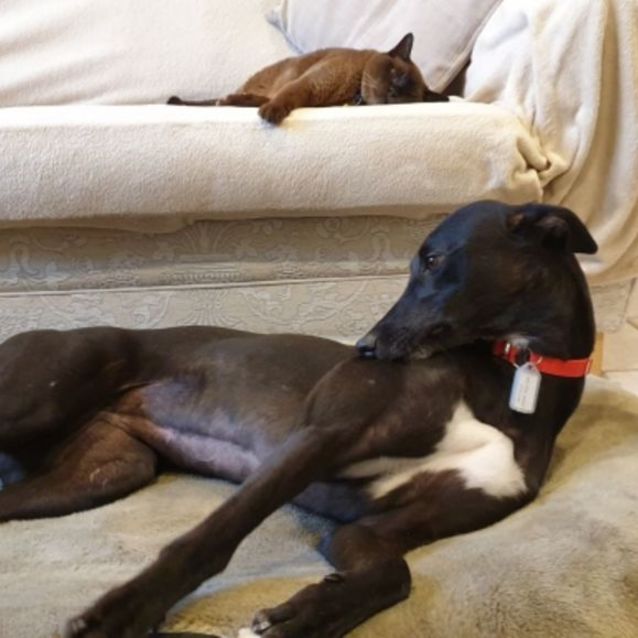
Locate an element on the screen. white tiled flooring is located at coordinates pos(627,359).